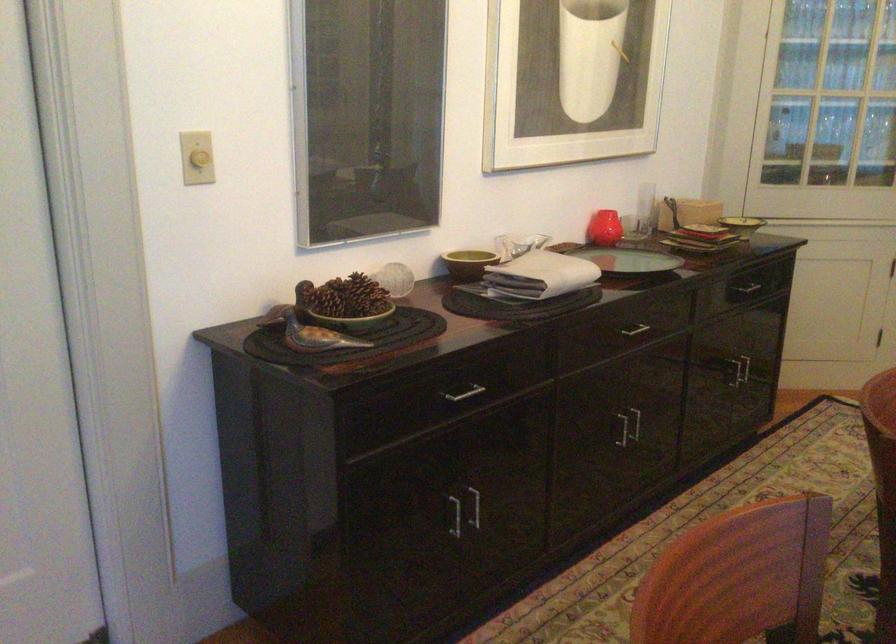
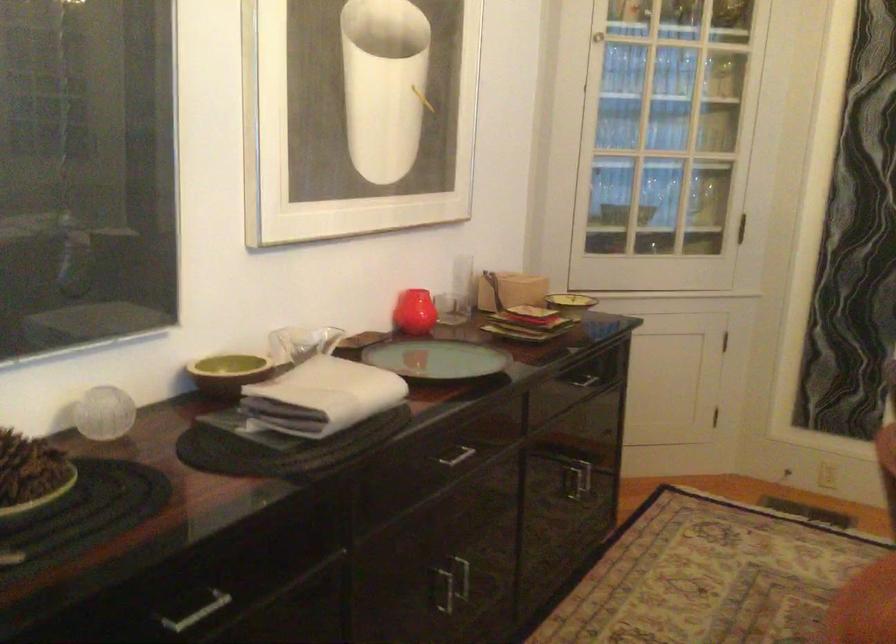
Where in the second image is the point corresponding to the point at 745,375 from the first image?

(574, 483)